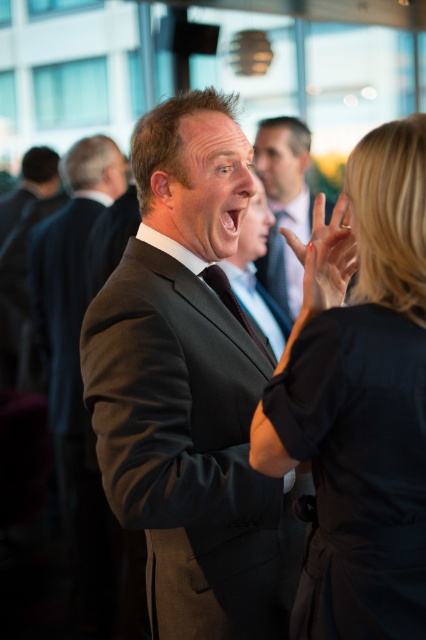
You are at a formal event and see a man in a matte black suit at center and a woman in a black matte dress at center. Which one is positioned to the left?

The black matte dress at center is to the left of the matte black suit at center.

You are at a formal event and see the dark gray suit at center and the smooth skin hand at center. Which object is closer to you?

The dark gray suit at center is closer to you than the smooth skin hand at center because it is in front of it.